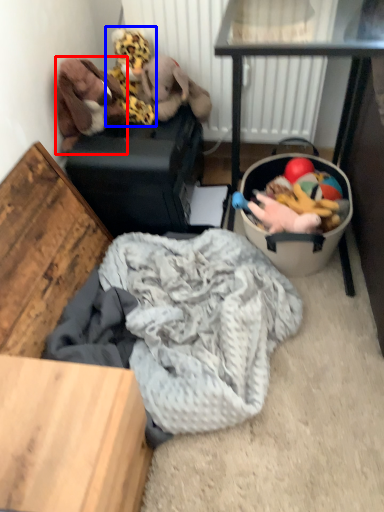
Question: Which object is further to the camera taking this photo, toy (highlighted by a red box) or toy (highlighted by a blue box)?

Choices:
 (A) toy
 (B) toy

Answer: (B)